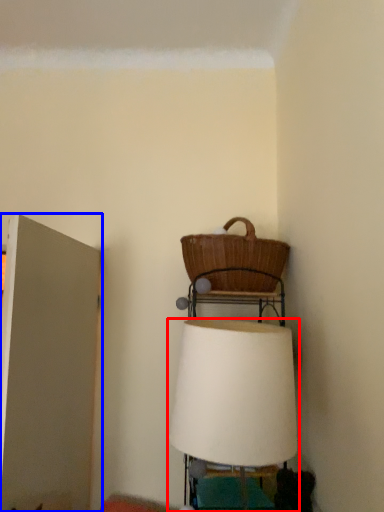
Question: Which object appears farthest to the camera in this image, lamp (highlighted by a red box) or door (highlighted by a blue box)?

Choices:
 (A) lamp
 (B) door

Answer: (B)